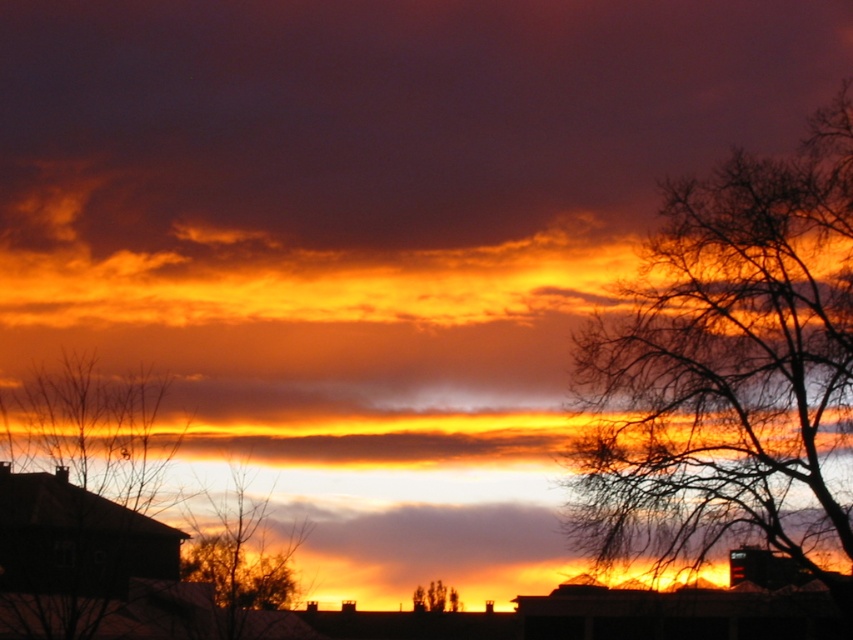
You are an artist painting the sunset scene. You notice two elements in the foreground that need to be proportionally accurate. Which of the two, the bare branches at upper right or the silhouette bare tree at left, should you draw narrower to maintain the scene proportions?

The bare branches at upper right has a lesser width compared to the silhouette bare tree at left, so you should draw the bare branches at upper right narrower to maintain the scene proportions.